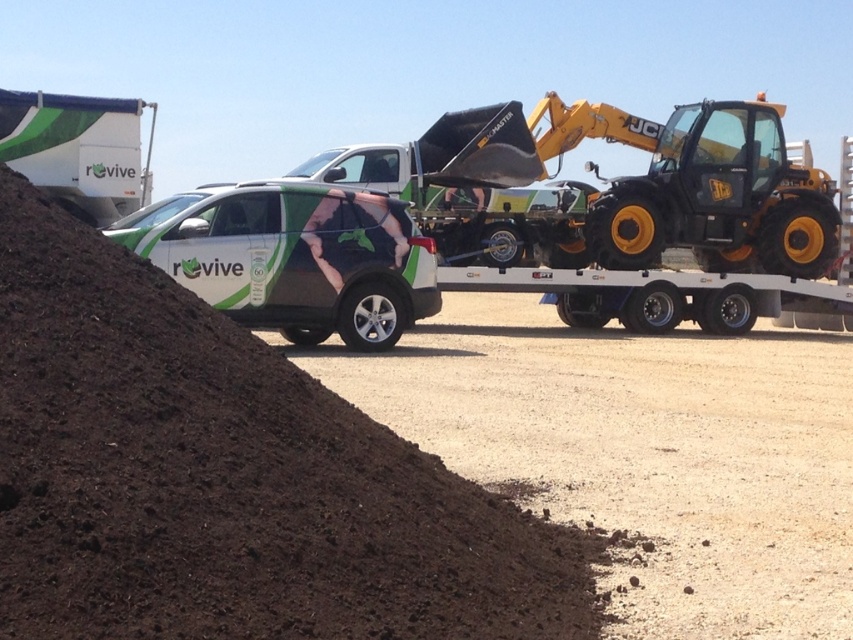
Which is above, dark brown soil at lower left or yellow metallic excavator at center?

yellow metallic excavator at center

Does dark brown soil at lower left have a lesser height compared to yellow metallic excavator at center?

Yes.

Does point (119, 307) come behind point (808, 269)?

No, it is in front of (808, 269).

Find the location of a particular element. This screenshot has width=853, height=640. dark brown soil at lower left is located at coordinates (227, 477).

Does dark brown soil at lower left have a greater height compared to white glossy suv at center?

No.

Measure the distance between point (129, 404) and camera.

They are 3.98 meters apart.

Find the location of a particular element. dark brown soil at lower left is located at coordinates (227, 477).

Does yellow metallic excavator at center have a lesser width compared to white glossy suv at center?

In fact, yellow metallic excavator at center might be wider than white glossy suv at center.

Measure the distance between yellow metallic excavator at center and camera.

yellow metallic excavator at center is 52.53 feet from camera.

Where is `yellow metallic excavator at center`? The width and height of the screenshot is (853, 640). yellow metallic excavator at center is located at coordinates (654, 182).